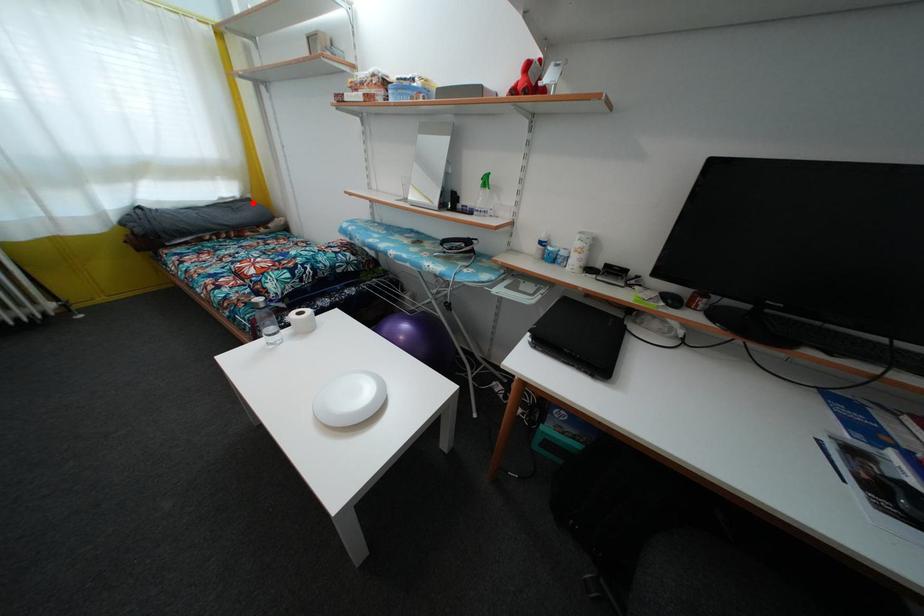
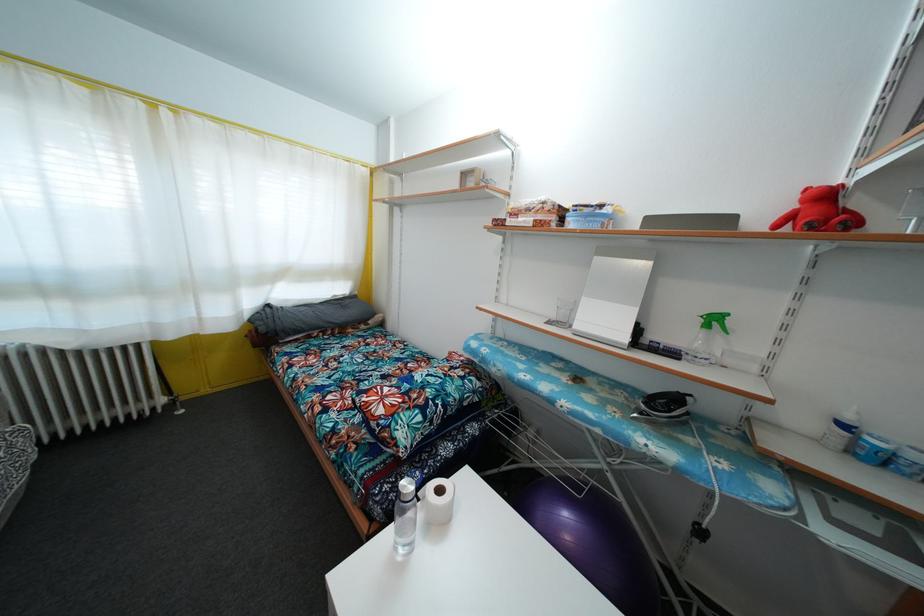
Locate, in the second image, the point that corresponds to the highlighted location in the first image.

(359, 300)